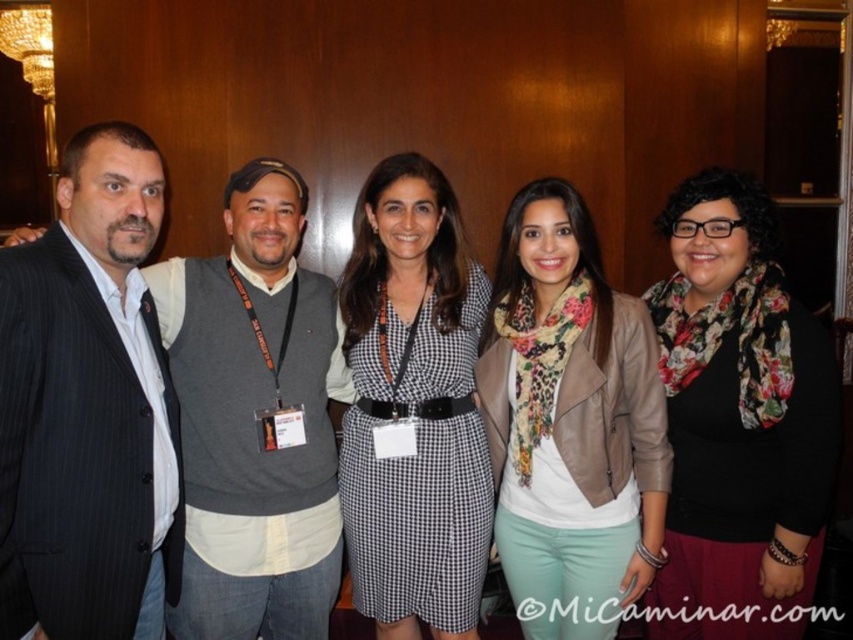
Question: Where is matte black suit at left located in relation to brown leather jacket at center in the image?

Choices:
 (A) below
 (B) above

Answer: (B)

Question: Does floral scarf at center appear under matte black suit at left?

Choices:
 (A) yes
 (B) no

Answer: (A)

Question: Which point appears farthest from the camera in this image?

Choices:
 (A) (521, 595)
 (B) (780, 339)
 (C) (170, 275)
 (D) (434, 420)

Answer: (A)

Question: Which object is the farthest from the brown leather jacket at center?

Choices:
 (A) floral scarf at center
 (B) matte black suit at left

Answer: (B)

Question: Is floral scarf at center closer to camera compared to black checkered dress at center?

Choices:
 (A) no
 (B) yes

Answer: (B)

Question: Which object is closer to the camera taking this photo?

Choices:
 (A) matte black suit at left
 (B) black checkered dress at center

Answer: (A)